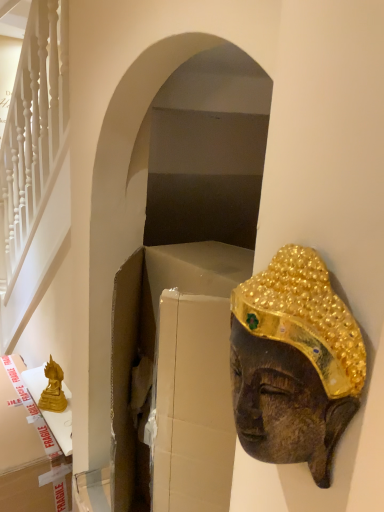
What do you see at coordinates (53, 389) in the screenshot? I see `gold matte statue at lower left` at bounding box center [53, 389].

The image size is (384, 512). What do you see at coordinates (294, 362) in the screenshot?
I see `gold textured mask at right` at bounding box center [294, 362].

Locate an element on the screen. Image resolution: width=384 pixels, height=512 pixels. gold cardboard box at left is located at coordinates (28, 450).

The image size is (384, 512). I want to click on gold matte statue at lower left, so click(x=53, y=389).

Is gold textured mask at right closer to camera compared to gold cardboard box at left?

Yes, gold textured mask at right is in front of gold cardboard box at left.

Considering the sizes of objects gold textured mask at right and gold cardboard box at left in the image provided, who is wider, gold textured mask at right or gold cardboard box at left?

gold cardboard box at left.

From a real-world perspective, relative to gold cardboard box at left, is gold textured mask at right vertically above or below?

In terms of real-world spatial position, gold textured mask at right is above gold cardboard box at left.

From the image's perspective, is gold textured mask at right below gold cardboard box at left?

No.

Are gold matte statue at lower left and gold textured mask at right located far from each other?

gold matte statue at lower left is positioned a significant distance from gold textured mask at right.

Considering the points (60, 368) and (352, 328), which point is behind, point (60, 368) or point (352, 328)?

The point (60, 368) is farther.

I want to click on statue behind the gold textured mask at right, so (x=53, y=389).

Which object is positioned more to the left, gold matte statue at lower left or gold textured mask at right?

Positioned to the left is gold matte statue at lower left.

Considering their positions, is gold textured mask at right located in front of or behind gold matte statue at lower left?

In the image, gold textured mask at right appears in front of gold matte statue at lower left.

From a real-world perspective, is gold textured mask at right on top of gold matte statue at lower left?

Correct, in the physical world, gold textured mask at right is higher than gold matte statue at lower left.

Would you say gold textured mask at right contains gold matte statue at lower left?

That's incorrect, gold matte statue at lower left is not inside gold textured mask at right.

Can you tell me how much gold textured mask at right and gold matte statue at lower left differ in facing direction?

gold textured mask at right and gold matte statue at lower left are facing 1.09 degrees away from each other.

Does gold matte statue at lower left have a lesser width compared to gold cardboard box at left?

Yes, gold matte statue at lower left is thinner than gold cardboard box at left.

Which point is more forward, (x=40, y=400) or (x=26, y=489)?

Positioned in front is point (x=26, y=489).

Can you confirm if gold matte statue at lower left is smaller than gold cardboard box at left?

Yes, gold matte statue at lower left is smaller than gold cardboard box at left.

Could you tell me if gold matte statue at lower left is turned towards gold cardboard box at left?

No, gold matte statue at lower left is not aimed at gold cardboard box at left.

Is point (31, 473) closer or farther from the camera than point (306, 456)?

Point (31, 473) is farther from the camera than point (306, 456).

Locate an element on the screen. The width and height of the screenshot is (384, 512). person on the right of gold cardboard box at left is located at coordinates (294, 362).

Looking at this image, is gold cardboard box at left oriented away from gold textured mask at right?

No, gold cardboard box at left's orientation is not away from gold textured mask at right.

Is gold cardboard box at left closer to the viewer compared to gold textured mask at right?

No, the depth of gold cardboard box at left is greater than that of gold textured mask at right.

From their relative heights in the image, would you say gold cardboard box at left is taller or shorter than gold matte statue at lower left?

In the image, gold cardboard box at left appears to be taller than gold matte statue at lower left.

In the scene shown: Can we say gold cardboard box at left lies outside gold matte statue at lower left?

Yes.

Identify the location of statue above the gold cardboard box at left (from a real-world perspective). Image resolution: width=384 pixels, height=512 pixels. (53, 389).

Locate an element on the screen. This screenshot has height=512, width=384. person that appears above the gold cardboard box at left (from the image's perspective) is located at coordinates (294, 362).

Where is `person above the gold matte statue at lower left (from a real-world perspective)`? The image size is (384, 512). person above the gold matte statue at lower left (from a real-world perspective) is located at coordinates (294, 362).

Based on their spatial positions, is gold cardboard box at left or gold textured mask at right closer to gold matte statue at lower left?

gold cardboard box at left is positioned closer to the anchor gold matte statue at lower left.

Considering their positions, is gold matte statue at lower left positioned further to gold textured mask at right than gold cardboard box at left?

The object further to gold textured mask at right is gold matte statue at lower left.

Which object lies nearer to the anchor point gold textured mask at right, gold cardboard box at left or gold matte statue at lower left?

gold cardboard box at left is positioned closer to the anchor gold textured mask at right.

Based on their spatial positions, is gold textured mask at right or gold cardboard box at left further from gold matte statue at lower left?

gold textured mask at right.

When comparing their distances from gold cardboard box at left, does gold textured mask at right or gold matte statue at lower left seem further?

gold textured mask at right is positioned further to the anchor gold cardboard box at left.

Based on their spatial positions, is gold matte statue at lower left or gold textured mask at right further from gold cardboard box at left?

Based on the image, gold textured mask at right appears to be further to gold cardboard box at left.

I want to click on cardboard box positioned between gold textured mask at right and gold matte statue at lower left from near to far, so click(x=28, y=450).